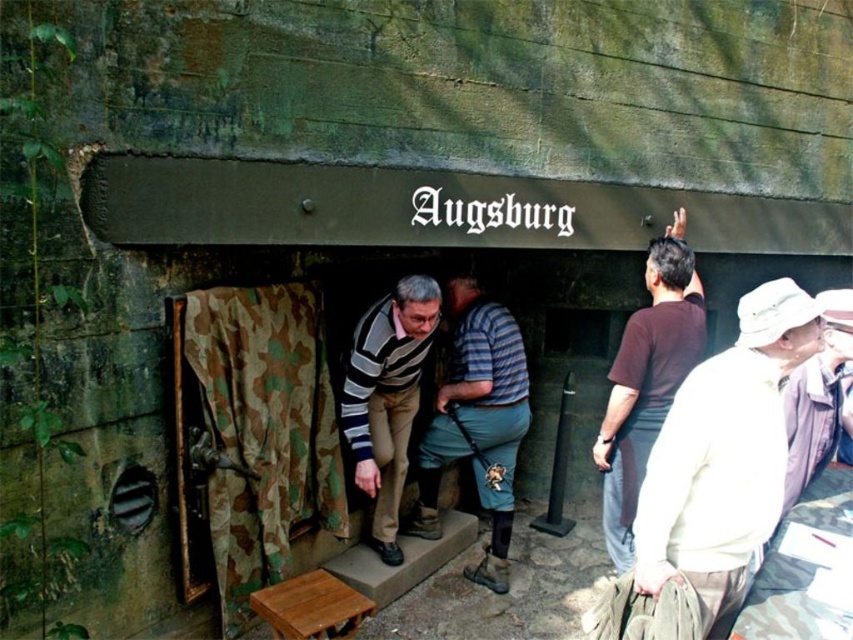
You are a delivery person who needs to place a 36 inch long package between the striped sweater at center and the wooden stool at lower center. Based on the scene, can you fit the package between them without moving either object?

The distance between the striped sweater at center and the wooden stool at lower center is 34.93 inches. Since the package is 36 inches long, it is slightly longer than the available space. Therefore, the package cannot be placed between them without moving either object.

You are a photographer setting up a shot of the bunker entrance. You have a white cotton hat at upper right and a camouflage fabric at center in your frame. Which object will appear smaller in your photo?

The camouflage fabric at center will appear smaller in the photo because it is thinner than the white cotton hat at upper right.